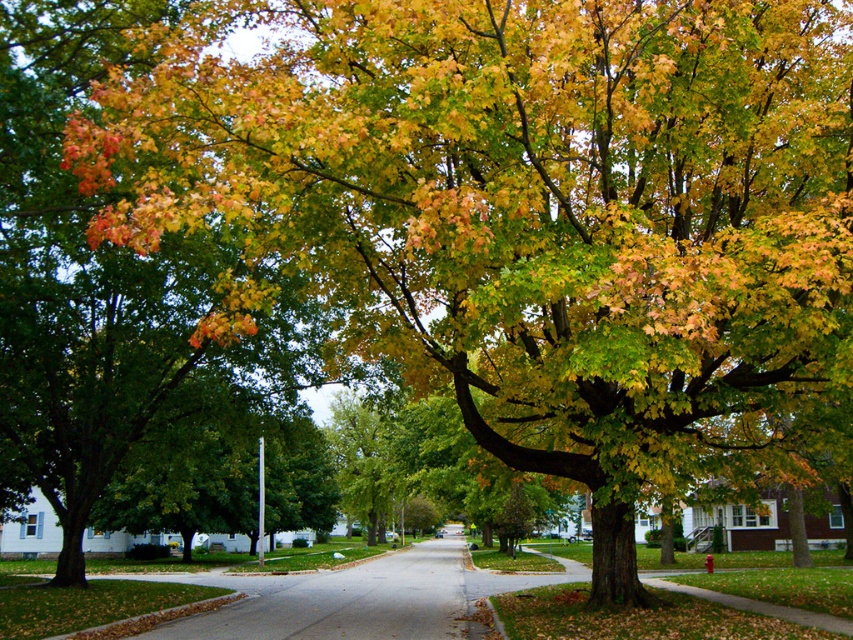
You are standing on the sidewalk in front of the large tree on the right side of the street. You see two points marked on the ground ahead of you, one at coordinates point (76, 60) and the other at point (369, 608). Which point is closer to you?

Point (76, 60) is closer to the viewer than point (369, 608).

You are standing on the sidewalk and want to walk to the gray asphalt road at center. Which direction should you head towards from the shiny green leaves at center?

You should head to the right from the shiny green leaves at center because the gray asphalt road at center is to the right of the shiny green leaves at center.

You are a gardener planning to mow the lawn between the shiny green leaves at center and the gray asphalt road at center. Which area should you avoid mowing to prevent damaging the road?

The gray asphalt road at center is narrower than the shiny green leaves at center, so you should avoid mowing the gray asphalt road at center to prevent damaging it.